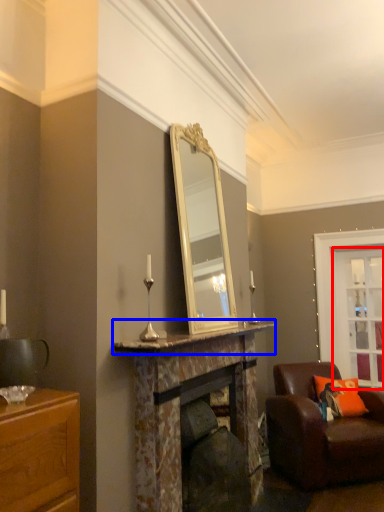
Question: Which object appears closest to the camera in this image, glass door (highlighted by a red box) or mantle (highlighted by a blue box)?

Choices:
 (A) glass door
 (B) mantle

Answer: (B)